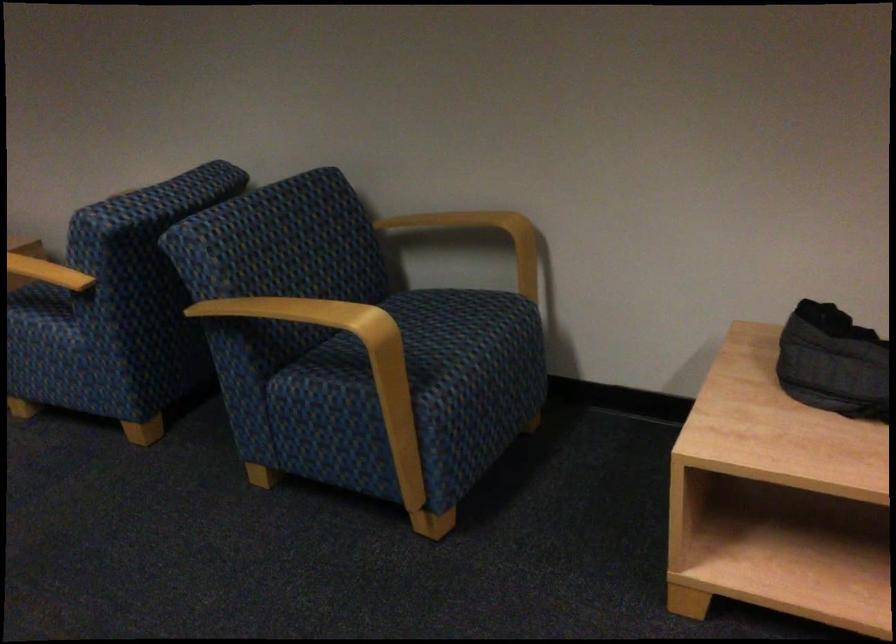
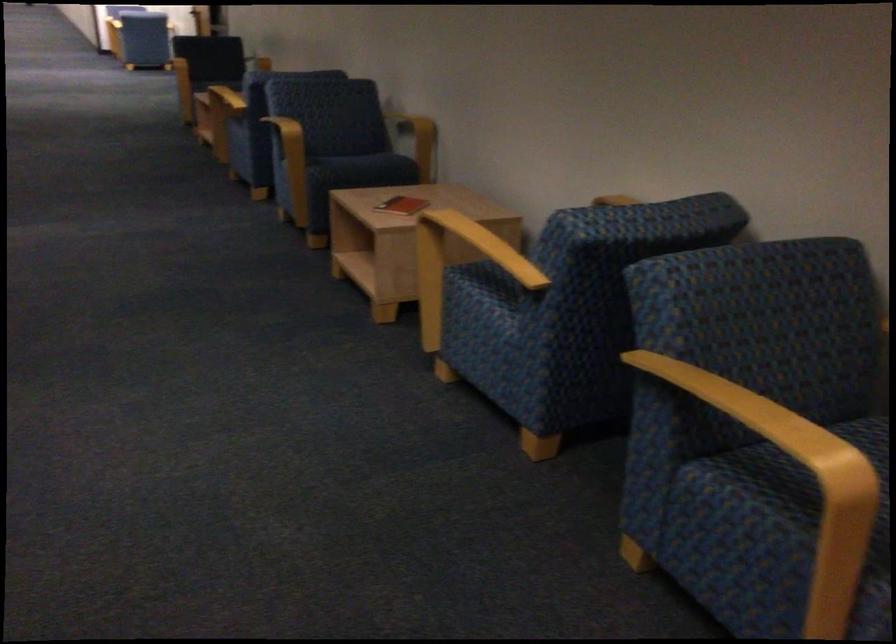
Question: The camera is either moving clockwise (left) or counter-clockwise (right) around the object. The first image is from the beginning of the video and the second image is from the end. Is the camera moving left or right when shooting the video?

Choices:
 (A) Left
 (B) Right

Answer: (B)